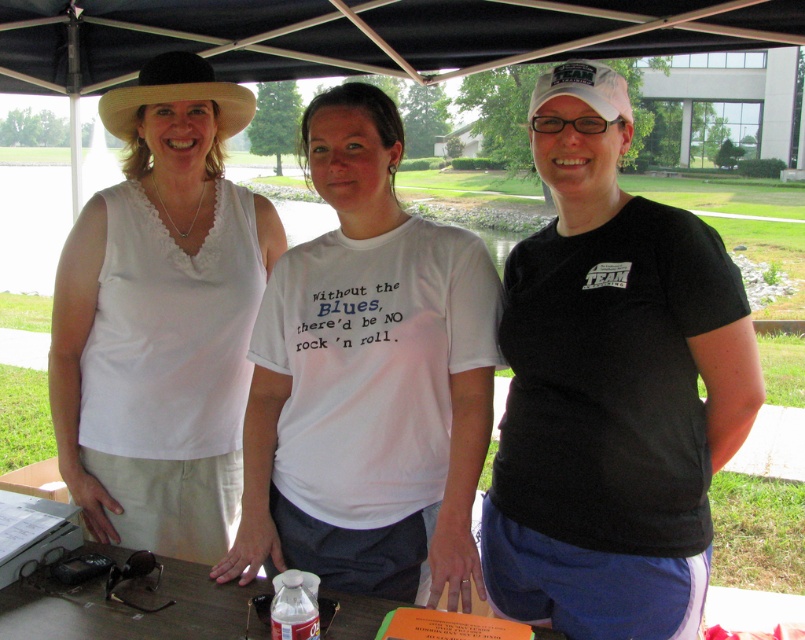
Question: Where is black matte t-shirt at center located in relation to black felt cowboy hat at upper left in the image?

Choices:
 (A) below
 (B) above

Answer: (A)

Question: Is white cotton t-shirt at center wider than black felt cowboy hat at upper left?

Choices:
 (A) yes
 (B) no

Answer: (A)

Question: Which object is closer to the camera taking this photo?

Choices:
 (A) black matte t-shirt at center
 (B) black felt cowboy hat at upper left
 (C) white cotton t-shirt at center
 (D) white fabric tank top at left

Answer: (A)

Question: Which of the following is the farthest from the observer?

Choices:
 (A) black felt cowboy hat at upper left
 (B) white fabric tank top at left

Answer: (B)

Question: Which object is positioned closest to the black matte t-shirt at center?

Choices:
 (A) black felt cowboy hat at upper left
 (B) white fabric tank top at left
 (C) white cotton t-shirt at center

Answer: (C)

Question: Is black matte t-shirt at center below white cotton t-shirt at center?

Choices:
 (A) no
 (B) yes

Answer: (B)